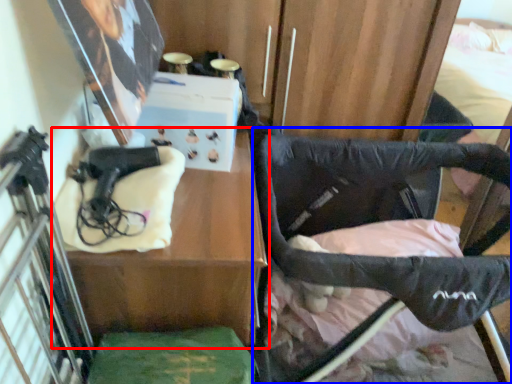
Question: Among these objects, which one is nearest to the camera, table (highlighted by a red box) or furniture (highlighted by a blue box)?

Choices:
 (A) table
 (B) furniture

Answer: (A)